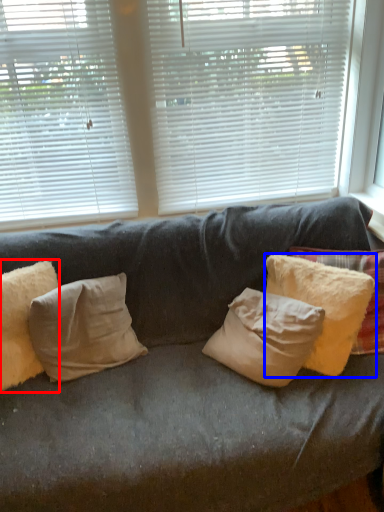
Question: Which object is further to the camera taking this photo, pillow (highlighted by a red box) or pillow (highlighted by a blue box)?

Choices:
 (A) pillow
 (B) pillow

Answer: (B)